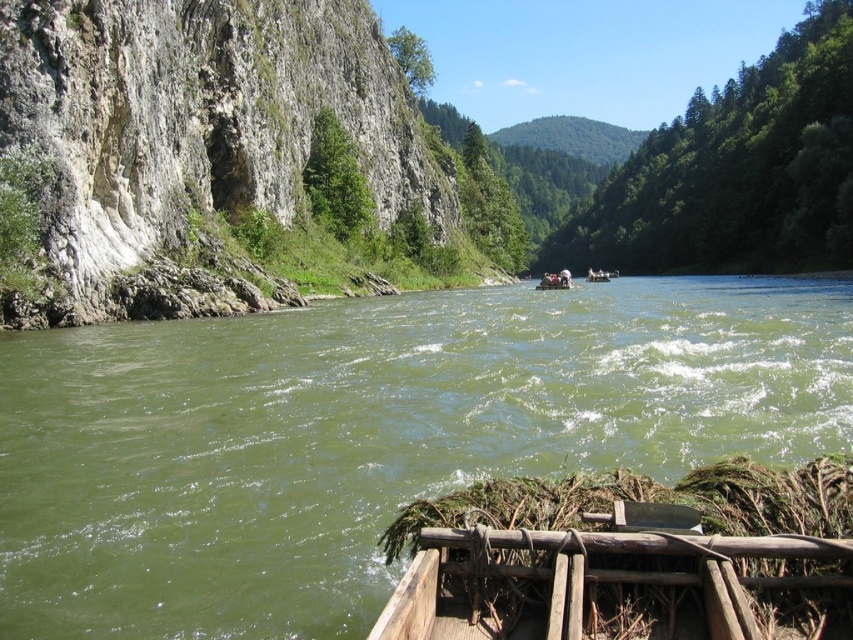
Between white rock cliff at left and green leafy trees at upper center, which one has more height?

With more height is green leafy trees at upper center.

Does white rock cliff at left have a lesser height compared to green leafy trees at upper center?

Yes.

Does point (99, 70) lie behind point (769, 115)?

No, it is not.

You are a GUI agent. You are given a task and a screenshot of the screen. Output one action in this format:
    pyautogui.click(x=<x>, y=<y>)
    Task: Click on the white rock cliff at left
    Image resolution: width=853 pixels, height=640 pixels.
    Given the screenshot: What is the action you would take?
    pyautogui.click(x=199, y=132)

Describe the element at coordinates (369, 435) in the screenshot. I see `greenish water at center` at that location.

Is greenish water at center smaller than wooden raft at center?

Actually, greenish water at center might be larger than wooden raft at center.

Locate an element on the screen. greenish water at center is located at coordinates (369, 435).

Between greenish water at center and white plastic raft at center, which one has more height?

white plastic raft at center is taller.

Does greenish water at center appear on the right side of white plastic raft at center?

Incorrect, greenish water at center is not on the right side of white plastic raft at center.

Is point (125, 348) less distant than point (595, 273)?

Yes, it is.

The image size is (853, 640). Find the location of `greenish water at center`. greenish water at center is located at coordinates (369, 435).